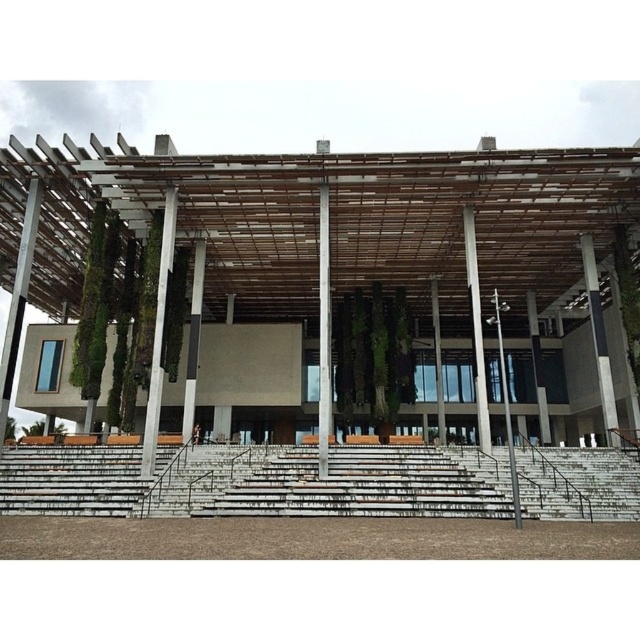
You are standing in front of the building and want to walk towards the wooden lattice structure at center and the white concrete stairs at lower center. Which one will you reach first?

You will reach the wooden lattice structure at center first because it is closer to the viewer than the white concrete stairs at lower center.

You are standing in front of the modern architectural structure and want to determine the relative positions of two points marked on the building. Which point is closer to you, point at coordinate (160, 401) or point at coordinate (477, 292)?

Point at coordinate (160, 401) is closer to you than point at coordinate (477, 292).